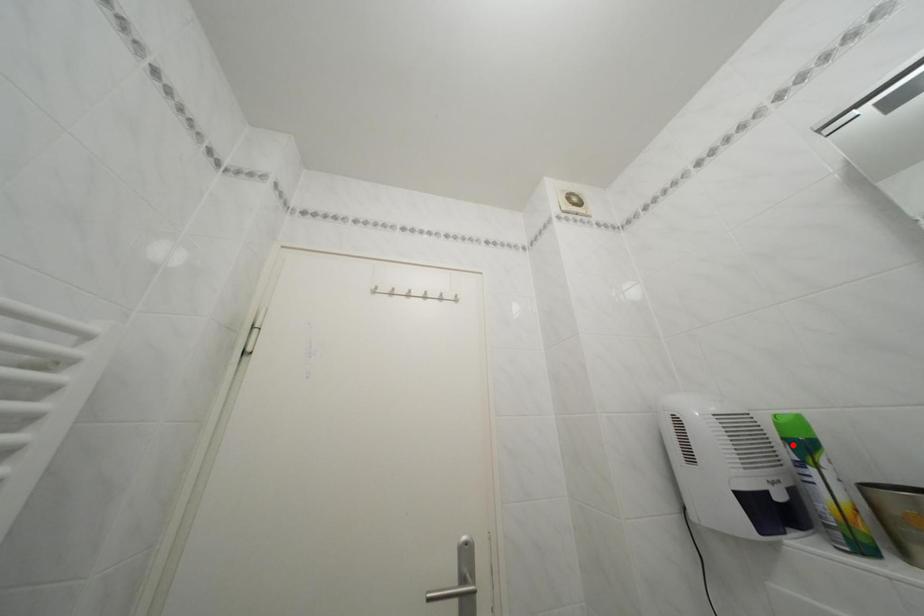
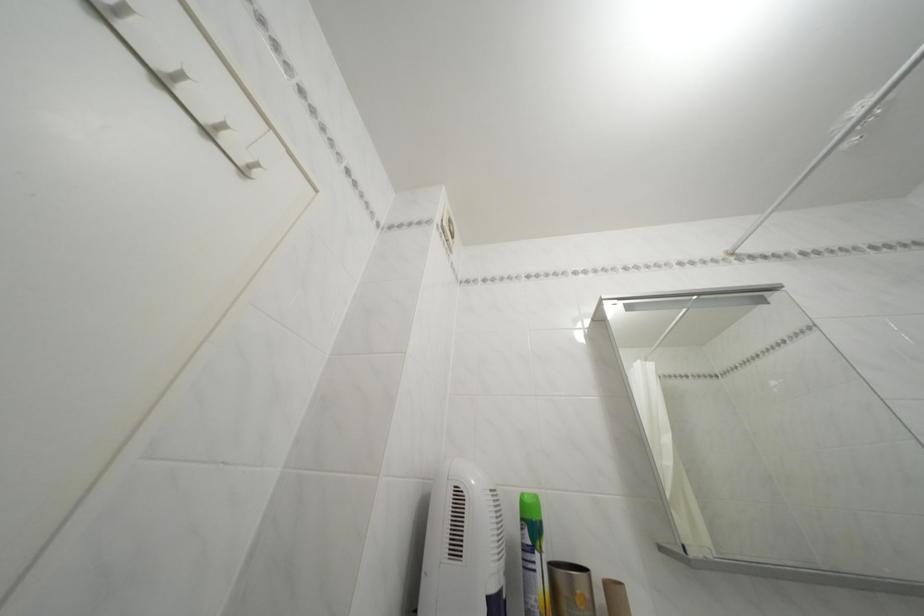
Find the pixel in the second image that matches the highlighted location in the first image.

(531, 525)